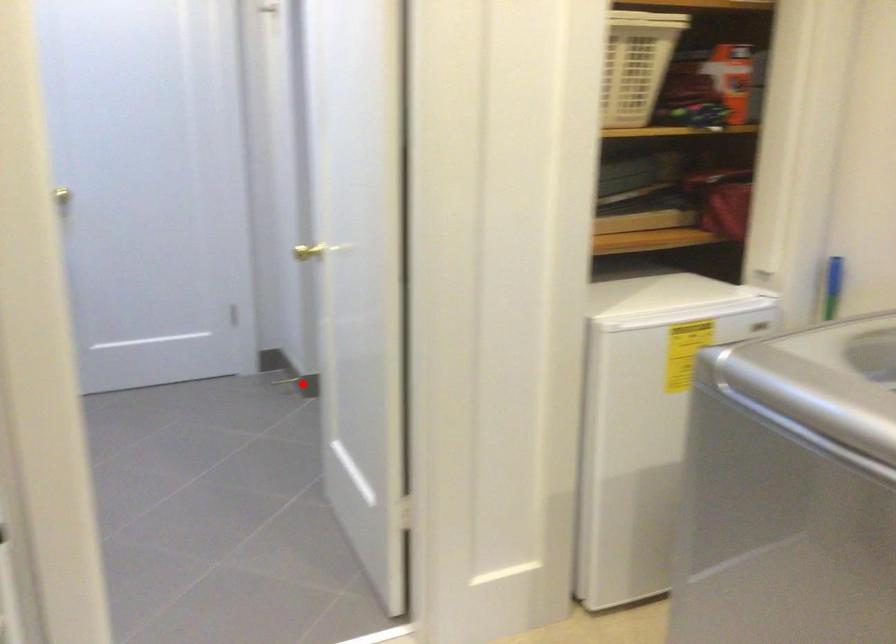
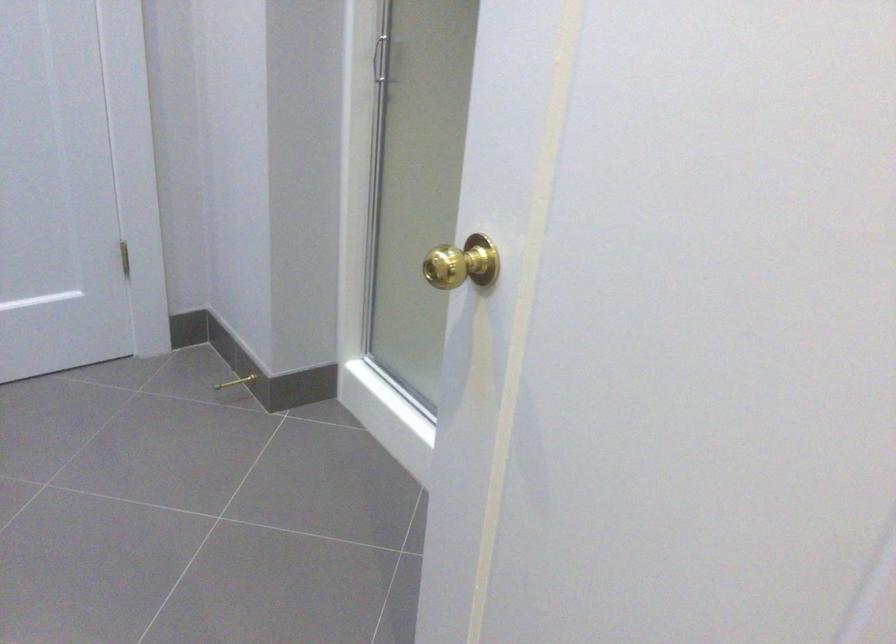
Question: I am providing you with two images of the same scene from different viewpoints. A red point is shown in image1. For the corresponding object point in image2, is it positioned nearer or farther from the camera?

Choices:
 (A) Nearer
 (B) Farther

Answer: (A)